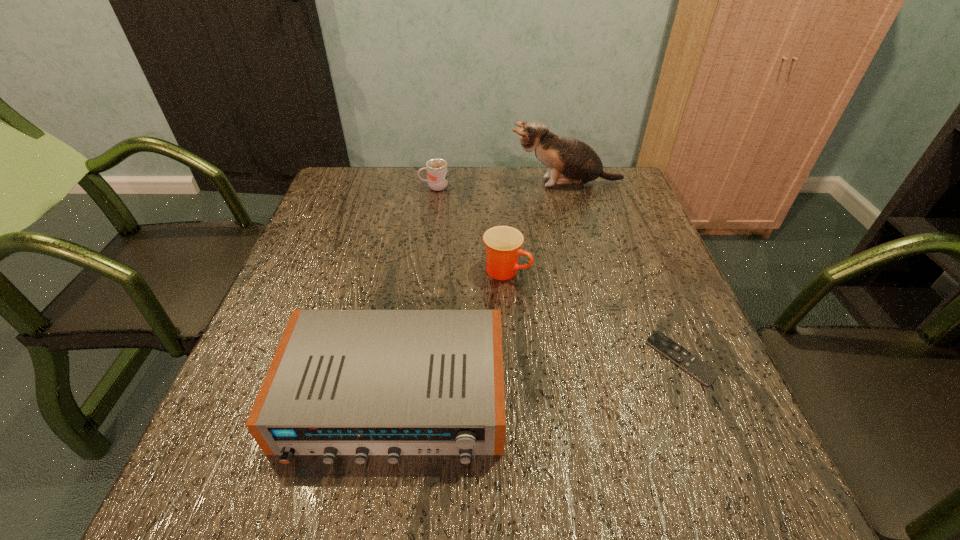
You are a GUI agent. You are given a task and a screenshot of the screen. Output one action in this format:
    pyautogui.click(x=<x>, y=<y>)
    Task: Click on the object positioned at the near left corner
    The image size is (960, 540).
    Given the screenshot: What is the action you would take?
    pyautogui.click(x=342, y=382)

Where is `object located in the far right corner section of the desktop`? This screenshot has height=540, width=960. object located in the far right corner section of the desktop is located at coordinates (570, 162).

In the image, there is a desktop. At what (x,y) coordinates should I click in order to perform the action: click on vacant space at the far edge. Please return your answer as a coordinate pair (x, y). Looking at the image, I should click on (510, 191).

Identify the location of vacant space at the near edge. (612, 464).

In the image, there is a desktop. Find the location of `vacant region at the left edge`. vacant region at the left edge is located at coordinates tap(313, 253).

You are a GUI agent. You are given a task and a screenshot of the screen. Output one action in this format:
    pyautogui.click(x=<x>, y=<y>)
    Task: Click on the free space at the right edge of the desktop
    This screenshot has height=540, width=960.
    Given the screenshot: What is the action you would take?
    pyautogui.click(x=719, y=416)

You are a GUI agent. You are given a task and a screenshot of the screen. Output one action in this format:
    pyautogui.click(x=<x>, y=<y>)
    Task: Click on the free region at the far left corner of the desktop
    Image resolution: width=960 pixels, height=540 pixels.
    Given the screenshot: What is the action you would take?
    pyautogui.click(x=385, y=178)

The image size is (960, 540). I want to click on empty location between the left cup and the shortest object, so click(x=558, y=273).

Where is `vacant space in between the cat and the farther cup`? The width and height of the screenshot is (960, 540). vacant space in between the cat and the farther cup is located at coordinates (500, 185).

The height and width of the screenshot is (540, 960). Identify the location of free point between the radio receiver and the shortest object. (538, 378).